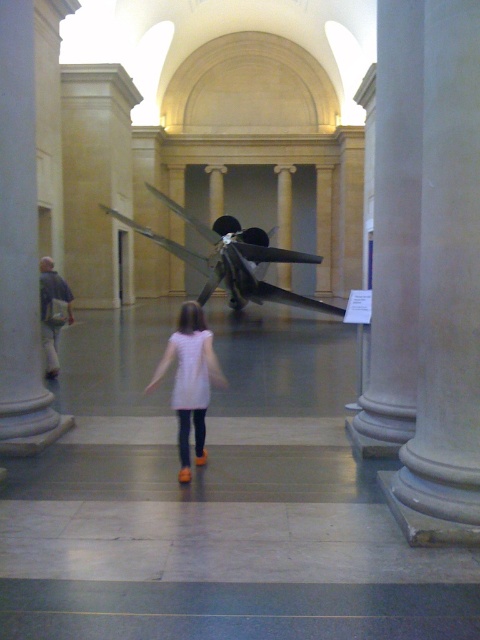
Between white marble pillar at center and smooth gray pillar at right, which one is positioned higher?

smooth gray pillar at right is higher up.

Can you confirm if white marble pillar at center is bigger than smooth gray pillar at right?

No, white marble pillar at center is not bigger than smooth gray pillar at right.

Which is behind, point (431, 531) or point (418, 113)?

The point (418, 113) is behind.

Locate an element on the screen. white marble pillar at center is located at coordinates (445, 291).

Who is shorter, white marble pillar at left or pink fabric dress at center?

With less height is pink fabric dress at center.

Is white marble pillar at left wider than pink fabric dress at center?

Correct, the width of white marble pillar at left exceeds that of pink fabric dress at center.

Locate an element on the screen. The height and width of the screenshot is (640, 480). white marble pillar at left is located at coordinates (19, 237).

Is smooth gray pillar at right below shiny metallic propeller at center?

Yes, smooth gray pillar at right is below shiny metallic propeller at center.

Between smooth gray pillar at right and shiny metallic propeller at center, which one appears on the right side from the viewer's perspective?

From the viewer's perspective, smooth gray pillar at right appears more on the right side.

Between point (394, 212) and point (263, 257), which one is positioned in front?

Point (394, 212)

Where is `smooth gray pillar at right`? The width and height of the screenshot is (480, 640). smooth gray pillar at right is located at coordinates 395,225.